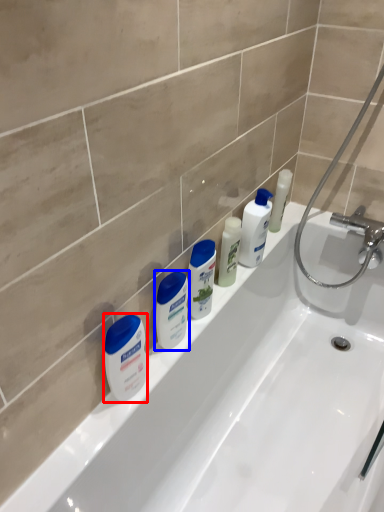
Question: Which object is closer to the camera taking this photo, cleaning product (highlighted by a red box) or toiletry (highlighted by a blue box)?

Choices:
 (A) cleaning product
 (B) toiletry

Answer: (A)